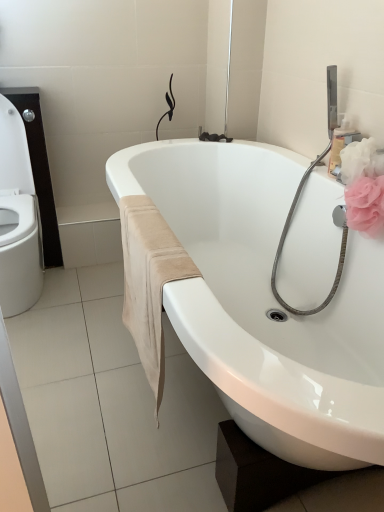
Identify the location of free space to the right of black rubber faucet at upper center. (244, 144).